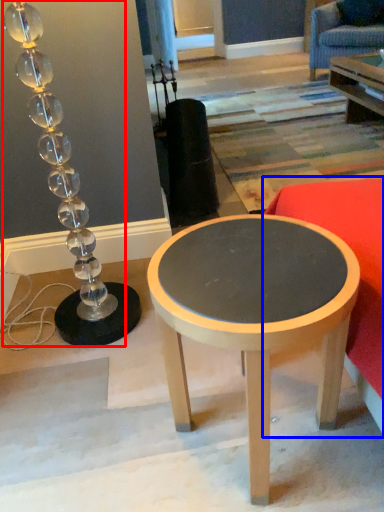
Question: Among these objects, which one is farthest to the camera, lamp (highlighted by a red box) or studio couch (highlighted by a blue box)?

Choices:
 (A) lamp
 (B) studio couch

Answer: (A)